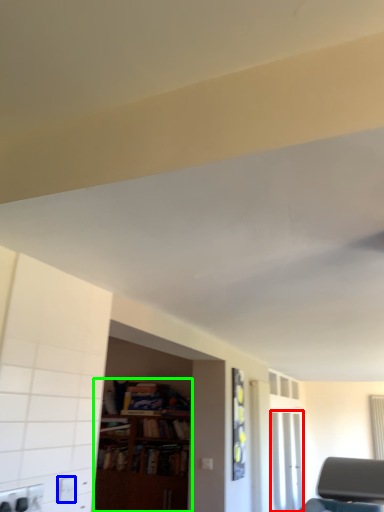
Question: Estimate the real-world distances between objects in this image. Which object is closer to glass door (highlighted by a red box), electric outlet (highlighted by a blue box) or bookcase (highlighted by a green box)?

Choices:
 (A) electric outlet
 (B) bookcase

Answer: (B)